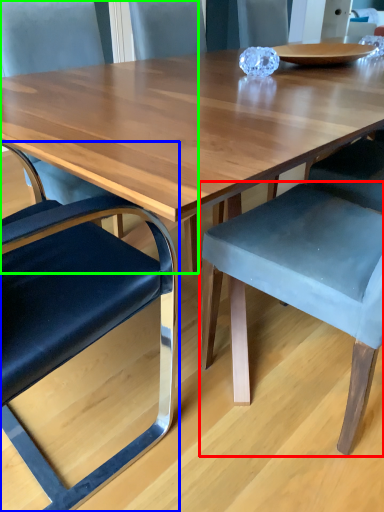
Question: Estimate the real-world distances between objects in this image. Which object is closer to chair (highlighted by a red box), chair (highlighted by a blue box) or chair (highlighted by a green box)?

Choices:
 (A) chair
 (B) chair

Answer: (A)